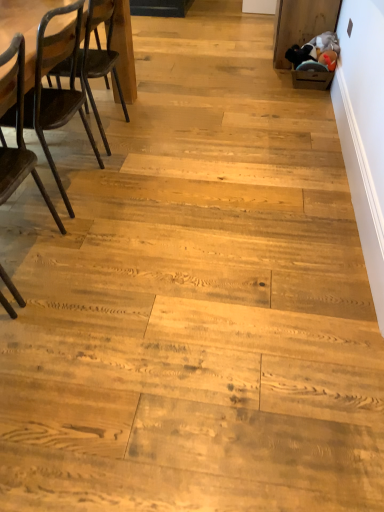
Question: Does dark brown wood chair at left, the 1th chair viewed from the front, have a lesser width compared to dark brown wood table at left?

Choices:
 (A) no
 (B) yes

Answer: (B)

Question: Is dark brown wood chair at left, the 2th chair viewed from the back, far from dark brown wood table at left?

Choices:
 (A) yes
 (B) no

Answer: (A)

Question: Is dark brown wood chair at left, the 1th chair viewed from the front, located outside dark brown wood table at left?

Choices:
 (A) no
 (B) yes

Answer: (B)

Question: Is the position of dark brown wood chair at left, the 1th chair viewed from the front, more distant than that of dark brown wood table at left?

Choices:
 (A) no
 (B) yes

Answer: (A)

Question: From the image's perspective, is dark brown wood chair at left, the 2th chair viewed from the back, above dark brown wood table at left?

Choices:
 (A) yes
 (B) no

Answer: (B)

Question: Is dark brown wood chair at left, the 2th chair viewed from the back, facing away from dark brown wood table at left?

Choices:
 (A) no
 (B) yes

Answer: (A)

Question: Is dark brown wood chair at left, positioned as the 2th chair in front-to-back order, outside dark brown wood table at left?

Choices:
 (A) no
 (B) yes

Answer: (B)

Question: Can you confirm if dark brown wood chair at left, marked as the first chair in a back-to-front arrangement, is wider than dark brown wood table at left?

Choices:
 (A) no
 (B) yes

Answer: (B)

Question: Considering the relative positions of dark brown wood chair at left, marked as the first chair in a back-to-front arrangement, and dark brown wood table at left in the image provided, is dark brown wood chair at left, marked as the first chair in a back-to-front arrangement, to the left of dark brown wood table at left from the viewer's perspective?

Choices:
 (A) yes
 (B) no

Answer: (A)

Question: Could you tell me if dark brown wood chair at left, positioned as the 2th chair in front-to-back order, is turned towards dark brown wood table at left?

Choices:
 (A) no
 (B) yes

Answer: (A)

Question: Is dark brown wood table at left at the back of dark brown wood chair at left, marked as the first chair in a back-to-front arrangement?

Choices:
 (A) yes
 (B) no

Answer: (B)

Question: Does dark brown wood chair at left, positioned as the 2th chair in front-to-back order, lie in front of dark brown wood table at left?

Choices:
 (A) yes
 (B) no

Answer: (A)

Question: Is dark brown wood chair at left, positioned as the 2th chair in front-to-back order, in front of dark brown wood chair at left, the 1th chair viewed from the front?

Choices:
 (A) no
 (B) yes

Answer: (A)